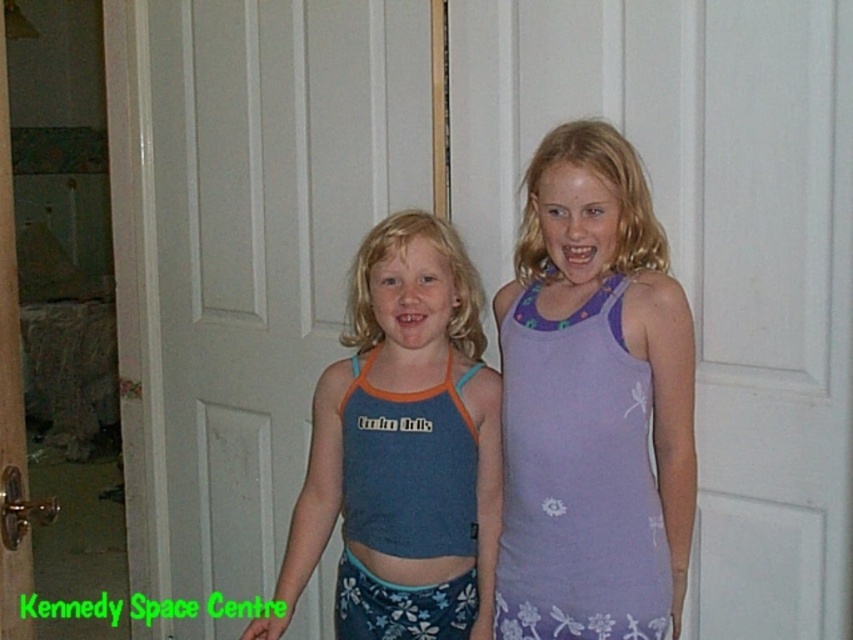
Is white matte door at center positioned before blue fabric tank top at center?

No.

Is white matte door at center behind blue fabric tank top at center?

Yes, it is behind blue fabric tank top at center.

Does point (207, 115) come in front of point (463, 369)?

No, (207, 115) is further to viewer.

The width and height of the screenshot is (853, 640). I want to click on white matte door at center, so click(265, 243).

Does white matte door at center have a lesser width compared to purple fabric tank top at center?

In fact, white matte door at center might be wider than purple fabric tank top at center.

Is white matte door at center bigger than purple fabric tank top at center?

Correct, white matte door at center is larger in size than purple fabric tank top at center.

I want to click on white matte door at center, so click(x=265, y=243).

Between point (515, 324) and point (485, 435), which one is positioned in front?

Point (515, 324)

Is point (548, 250) farther from viewer compared to point (395, 620)?

That is False.

Which is behind, point (548, 458) or point (461, 394)?

Point (461, 394)

You are a GUI agent. You are given a task and a screenshot of the screen. Output one action in this format:
    pyautogui.click(x=<x>, y=<y>)
    Task: Click on the purple fabric tank top at center
    The image size is (853, 640).
    Given the screenshot: What is the action you would take?
    pyautogui.click(x=593, y=403)